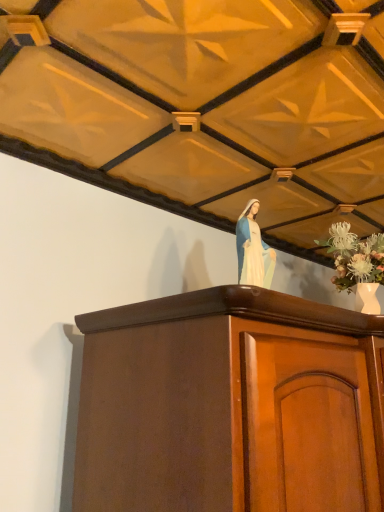
Question: Relative to white porcelain vase at upper right, is mahogany cabinet at center in front or behind?

Choices:
 (A) front
 (B) behind

Answer: (A)

Question: From a real-world perspective, is mahogany cabinet at center above or below white porcelain vase at upper right?

Choices:
 (A) above
 (B) below

Answer: (B)

Question: Which is nearer to the white porcelain statue at upper center?

Choices:
 (A) mahogany cabinet at center
 (B) white porcelain vase at upper right

Answer: (A)

Question: Which of these objects is positioned closest to the mahogany cabinet at center?

Choices:
 (A) white porcelain vase at upper right
 (B) white porcelain statue at upper center

Answer: (B)